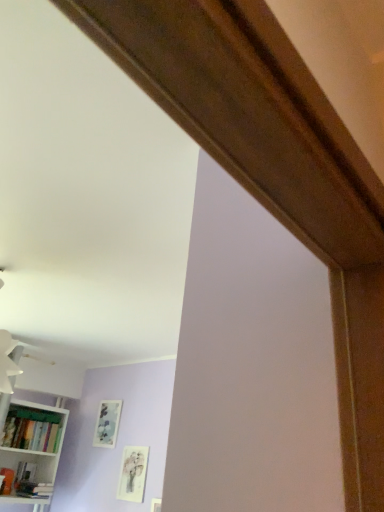
Question: In terms of width, does matte silver picture frame at center, the 1th picture frame when ordered from left to right, look wider or thinner when compared to matte white picture frame at lower left, arranged as the 1th picture frame when viewed from the front?

Choices:
 (A) wide
 (B) thin

Answer: (A)

Question: Considering the positions of matte silver picture frame at center, placed as the first picture frame when sorted from back to front, and matte white picture frame at lower left, which is the 1th picture frame from right to left, in the image, is matte silver picture frame at center, placed as the first picture frame when sorted from back to front, taller or shorter than matte white picture frame at lower left, which is the 1th picture frame from right to left,?

Choices:
 (A) short
 (B) tall

Answer: (A)

Question: Based on their relative distances, which object is farther from the matte silver picture frame at center, placed as the first picture frame when sorted from back to front?

Choices:
 (A) white matte bookshelf at lower left
 (B) matte white picture frame at lower left, the 2th picture frame from the left
 (C) matte green bookshelf at lower left

Answer: (A)

Question: Based on their relative distances, which object is nearer to the matte green bookshelf at lower left?

Choices:
 (A) matte white picture frame at lower left, arranged as the 1th picture frame when viewed from the front
 (B) matte silver picture frame at center, the 1th picture frame when ordered from left to right
 (C) white matte bookshelf at lower left

Answer: (C)